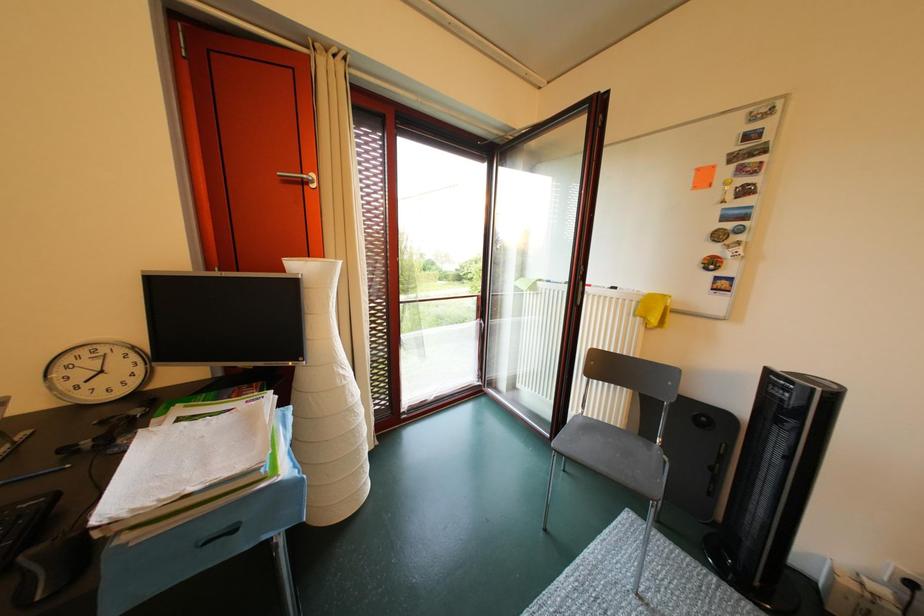
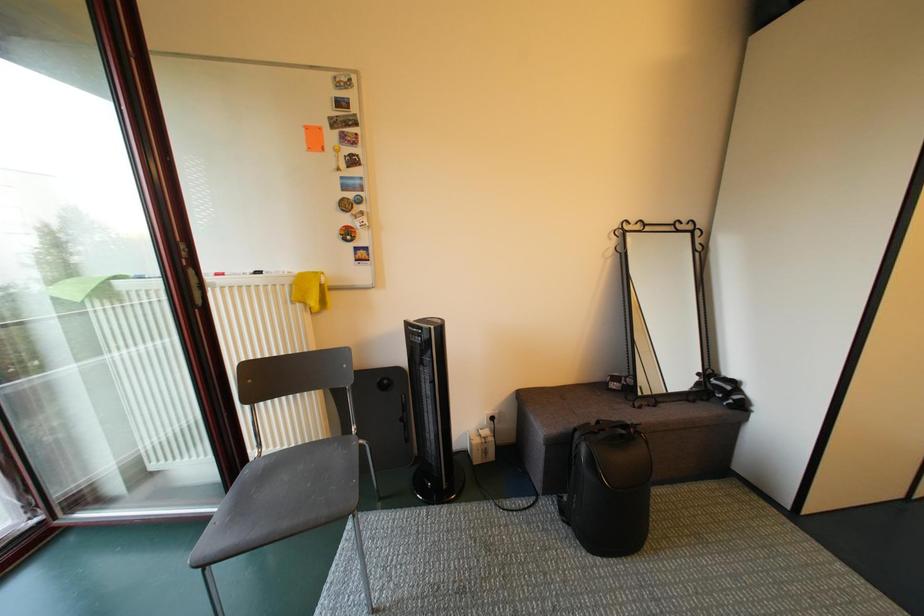
Question: How did the camera likely rotate?

Choices:
 (A) Left
 (B) Right
 (C) Up
 (D) Down

Answer: (B)